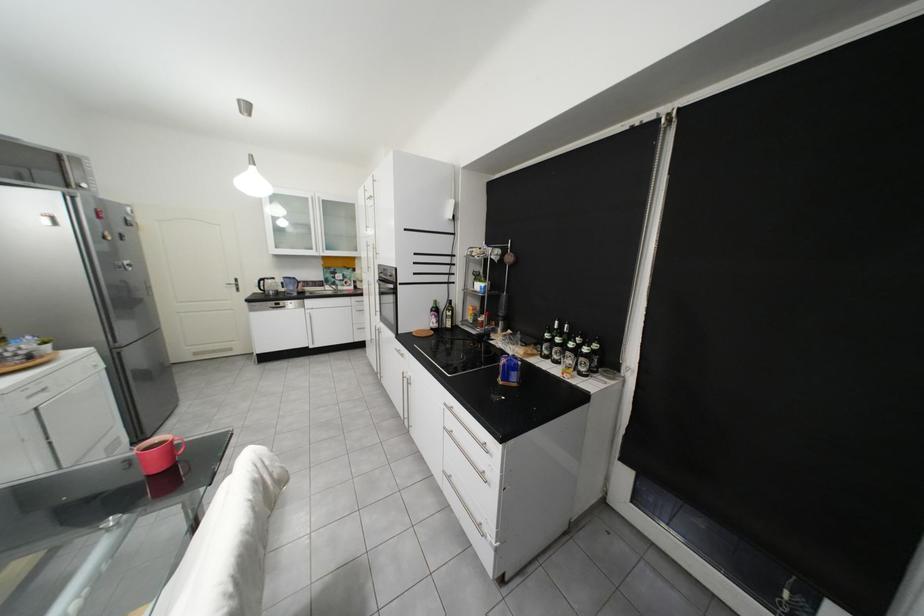
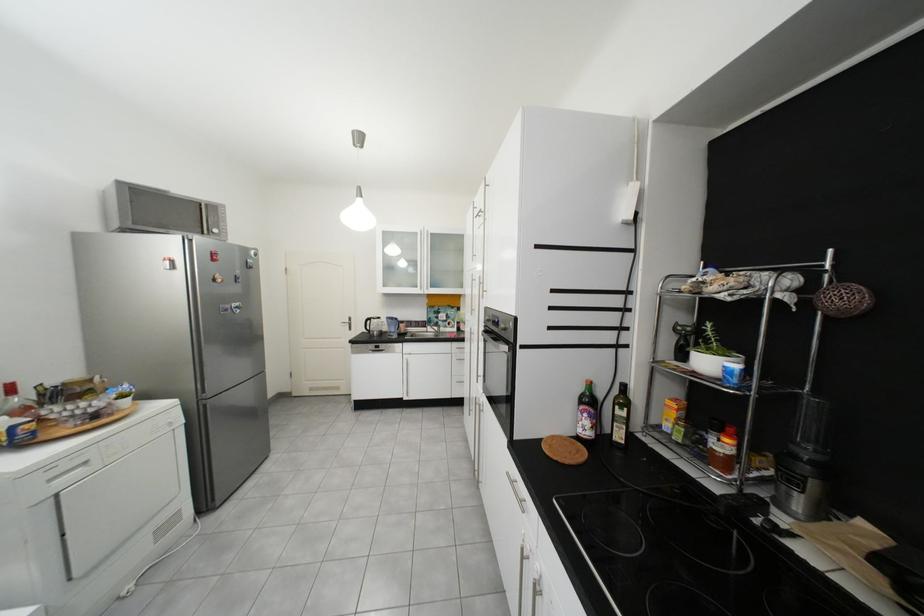
Where in the second image is the point corresponding to point 444,312 from the first image?

(592, 403)